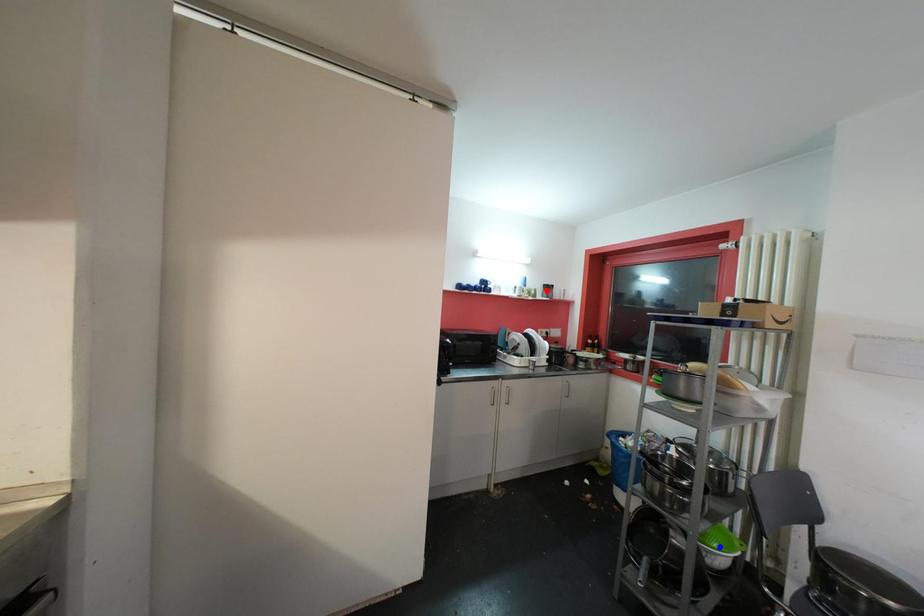
Question: In the image, two points are highlighted. Which point is nearer to the camera? Reply with the corresponding letter.

Choices:
 (A) blue point
 (B) red point

Answer: (A)